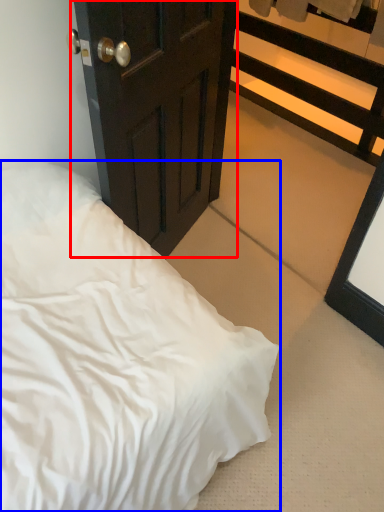
Question: Among these objects, which one is farthest to the camera, door (highlighted by a red box) or bed (highlighted by a blue box)?

Choices:
 (A) door
 (B) bed

Answer: (B)